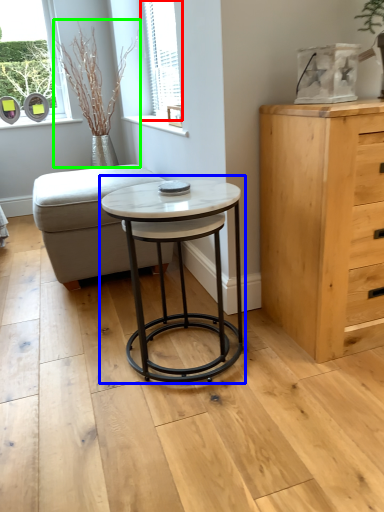
Question: Based on their relative distances, which object is farther from window (highlighted by a red box)? Choose from coffee table (highlighted by a blue box) and plant (highlighted by a green box).

Choices:
 (A) coffee table
 (B) plant

Answer: (A)